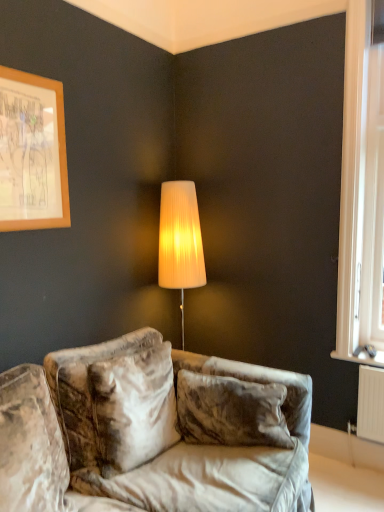
Question: From a real-world perspective, is wooden frame at upper left physically above white plastic window at right?

Choices:
 (A) yes
 (B) no

Answer: (A)

Question: Does wooden frame at upper left have a lesser width compared to white plastic window at right?

Choices:
 (A) yes
 (B) no

Answer: (A)

Question: Is wooden frame at upper left turned away from white plastic window at right?

Choices:
 (A) no
 (B) yes

Answer: (A)

Question: Does wooden frame at upper left appear on the right side of white plastic window at right?

Choices:
 (A) no
 (B) yes

Answer: (A)

Question: Are wooden frame at upper left and white plastic window at right making contact?

Choices:
 (A) no
 (B) yes

Answer: (A)

Question: From the image's perspective, does wooden frame at upper left appear higher than white plastic window at right?

Choices:
 (A) yes
 (B) no

Answer: (A)

Question: From a real-world perspective, is white plastic window at right beneath wooden frame at upper left?

Choices:
 (A) yes
 (B) no

Answer: (A)

Question: Does white plastic window at right have a lesser height compared to wooden frame at upper left?

Choices:
 (A) yes
 (B) no

Answer: (B)

Question: Considering the relative sizes of white plastic window at right and wooden frame at upper left in the image provided, is white plastic window at right thinner than wooden frame at upper left?

Choices:
 (A) no
 (B) yes

Answer: (A)

Question: From the image's perspective, is white plastic window at right located beneath wooden frame at upper left?

Choices:
 (A) yes
 (B) no

Answer: (A)

Question: Is the position of white plastic window at right less distant than that of wooden frame at upper left?

Choices:
 (A) yes
 (B) no

Answer: (B)

Question: Can wooden frame at upper left be found inside white plastic window at right?

Choices:
 (A) yes
 (B) no

Answer: (B)

Question: From the image's perspective, is wooden frame at upper left located beneath velvet couch at lower center?

Choices:
 (A) no
 (B) yes

Answer: (A)